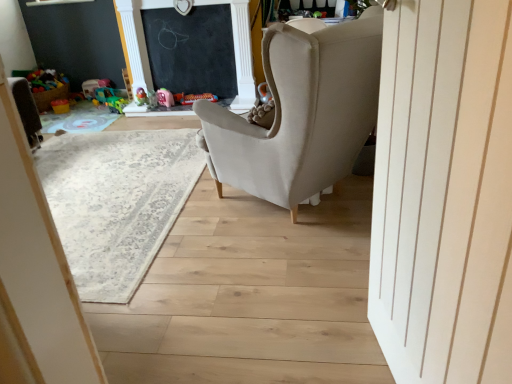
At what (x,y) coordinates should I click in order to perform the action: click on free space to the left of rubberized green toy at center, the second toy in the left-to-right sequence. Please return your answer as a coordinate pair (x, y). The image size is (512, 384). Looking at the image, I should click on (102, 112).